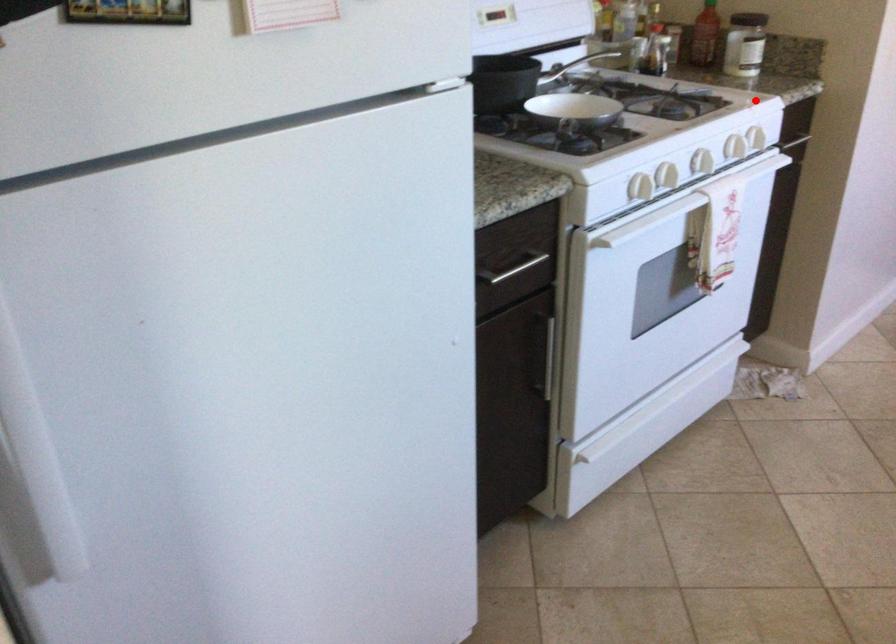
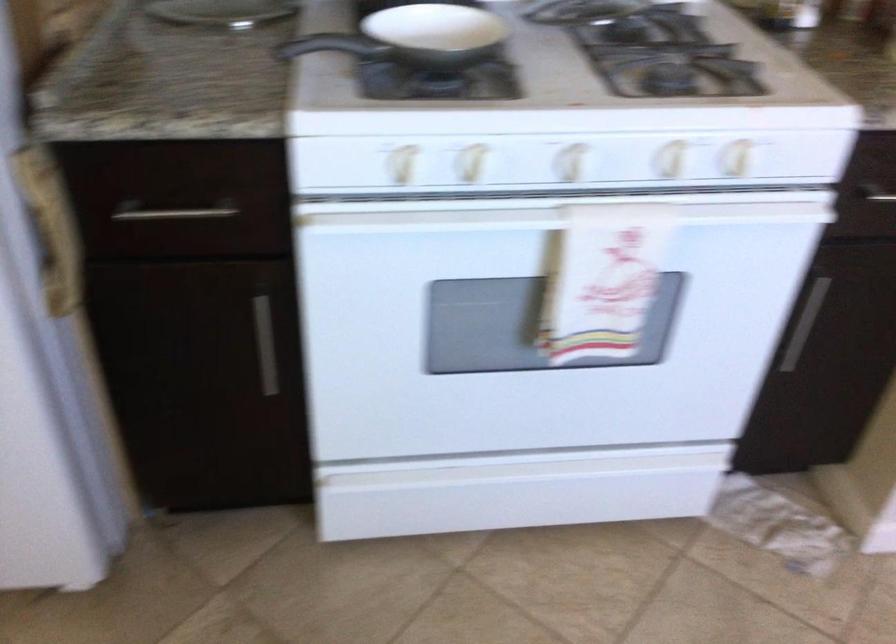
Locate, in the second image, the point that corresponds to the highlighted location in the first image.

(737, 158)